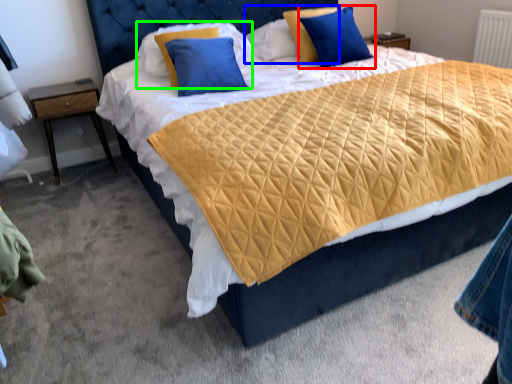
Question: Which object is positioned closest to pillow (highlighted by a red box)? Select from pillow (highlighted by a blue box) and pillow (highlighted by a green box).

Choices:
 (A) pillow
 (B) pillow

Answer: (A)